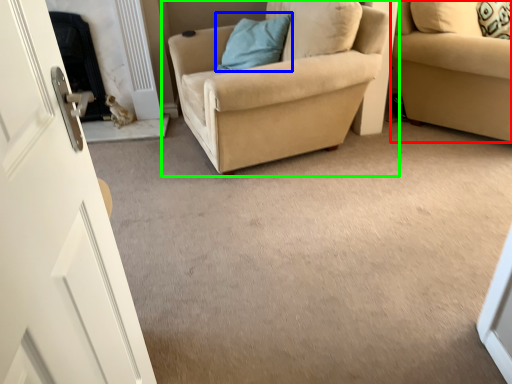
Question: Considering the real-world distances, which object is closest to studio couch (highlighted by a red box)? pillow (highlighted by a blue box) or chair (highlighted by a green box).

Choices:
 (A) pillow
 (B) chair

Answer: (B)